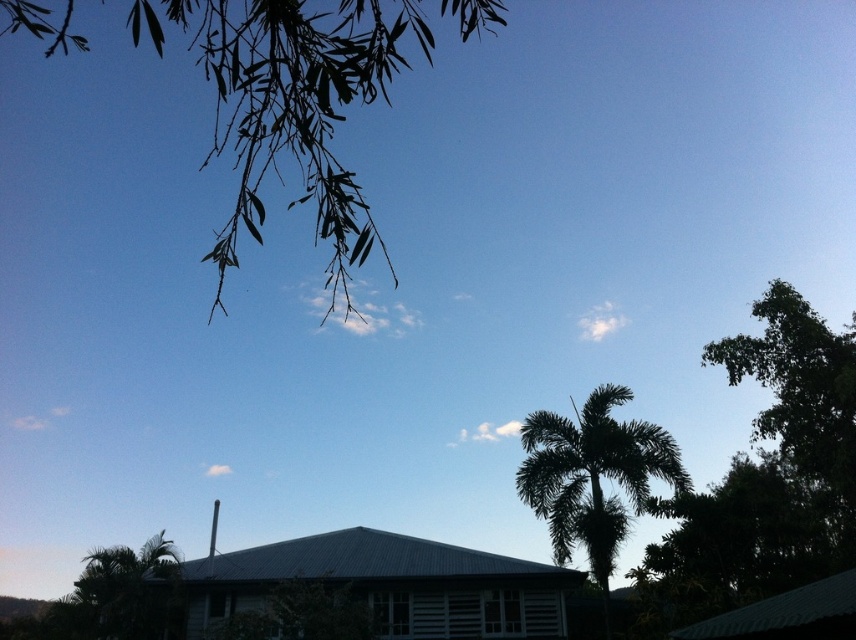
You are standing in the middle of the scene and want to walk towards the palm trees. Which direction should you face to walk towards the dark green leafy palm tree at center and the green leafy palm tree at lower left?

To walk towards the dark green leafy palm tree at center, you should face towards the right side of the scene. To walk towards the green leafy palm tree at lower left, you should face towards the left side of the scene.